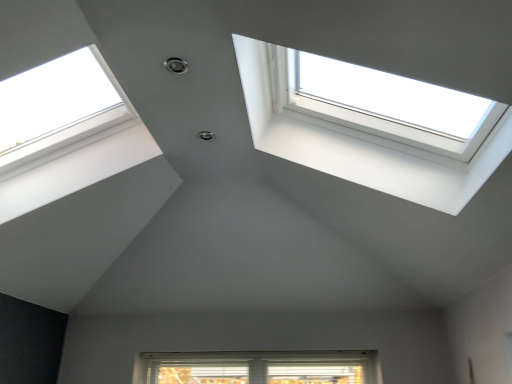
Question: Is white plastic window at upper left, which is counted as the 1th window, starting from the left, next to white plastic window at upper right, positioned as the second window in left-to-right order?

Choices:
 (A) no
 (B) yes

Answer: (A)

Question: Can you confirm if white plastic window at upper left, which is counted as the 1th window, starting from the left, is smaller than white plastic window at upper right, positioned as the second window in left-to-right order?

Choices:
 (A) yes
 (B) no

Answer: (A)

Question: Can you confirm if white plastic window at upper left, the 2th window when ordered from right to left, is positioned to the left of white plastic window at upper right, positioned as the second window in left-to-right order?

Choices:
 (A) yes
 (B) no

Answer: (A)

Question: Can you confirm if white plastic window at upper left, which is counted as the 1th window, starting from the left, is positioned to the right of white plastic window at upper right, which is the 1th window from right to left?

Choices:
 (A) yes
 (B) no

Answer: (B)

Question: Is white plastic window at upper right, which is the 1th window from right to left, located within white plastic window at upper left, the 2th window when ordered from right to left?

Choices:
 (A) yes
 (B) no

Answer: (B)

Question: Is white plastic window at upper left, which is counted as the 1th window, starting from the left, facing towards white plastic window at upper right, which is the 1th window from right to left?

Choices:
 (A) yes
 (B) no

Answer: (A)

Question: From a real-world perspective, is white plastic window at upper right, which is the 1th window from right to left, beneath white plastic window at upper left, the 2th window when ordered from right to left?

Choices:
 (A) no
 (B) yes

Answer: (A)

Question: From the image's perspective, is white plastic window at upper right, which is the 1th window from right to left, over white plastic window at upper left, the 2th window when ordered from right to left?

Choices:
 (A) no
 (B) yes

Answer: (B)

Question: Considering the relative positions of white plastic window at upper right, which is the 1th window from right to left, and white plastic window at upper left, which is counted as the 1th window, starting from the left, in the image provided, is white plastic window at upper right, which is the 1th window from right to left, in front of white plastic window at upper left, which is counted as the 1th window, starting from the left,?

Choices:
 (A) no
 (B) yes

Answer: (B)

Question: Considering the relative sizes of white plastic window at upper right, positioned as the second window in left-to-right order, and white plastic window at upper left, which is counted as the 1th window, starting from the left, in the image provided, is white plastic window at upper right, positioned as the second window in left-to-right order, wider than white plastic window at upper left, which is counted as the 1th window, starting from the left,?

Choices:
 (A) no
 (B) yes

Answer: (B)

Question: Is white plastic window at upper right, which is the 1th window from right to left, far from white plastic window at upper left, the 2th window when ordered from right to left?

Choices:
 (A) yes
 (B) no

Answer: (B)

Question: Is white plastic window at upper left, which is counted as the 1th window, starting from the left, at the back of white plastic window at upper right, which is the 1th window from right to left?

Choices:
 (A) no
 (B) yes

Answer: (A)

Question: From a real-world perspective, is white plastic window at upper right, positioned as the second window in left-to-right order, physically located above or below white plastic window at upper left, which is counted as the 1th window, starting from the left?

Choices:
 (A) above
 (B) below

Answer: (A)